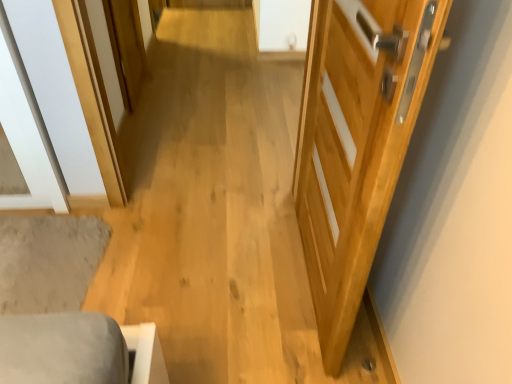
I want to click on free space below natural wood door at right (from a real-world perspective), so click(x=301, y=277).